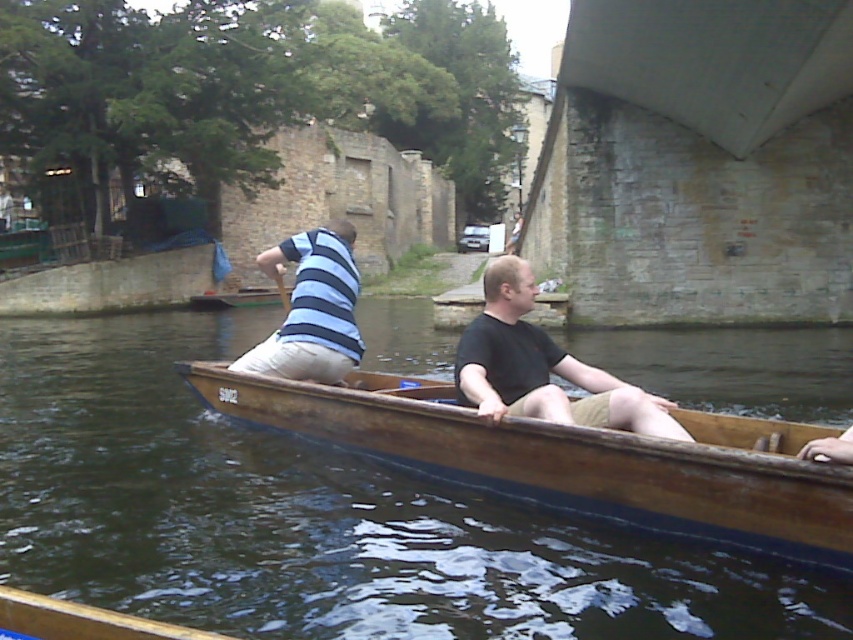
Question: Which of the following is the closest to the observer?

Choices:
 (A) (318, 253)
 (B) (283, 289)
 (C) (547, 353)
 (D) (621, 449)

Answer: (D)

Question: From the image, what is the correct spatial relationship of matte black shirt at center in relation to blue striped shirt at center?

Choices:
 (A) left
 (B) right

Answer: (B)

Question: Does blue striped shirt at center have a lesser width compared to wooden paddle at center?

Choices:
 (A) no
 (B) yes

Answer: (A)

Question: Does wooden canoe at center appear on the right side of wooden paddle at center?

Choices:
 (A) no
 (B) yes

Answer: (B)

Question: Which is farther from the wooden paddle at center?

Choices:
 (A) blue striped shirt at center
 (B) matte black shirt at center
 (C) wooden canoe at center

Answer: (B)

Question: Which is nearer to the matte black shirt at center?

Choices:
 (A) wooden paddle at center
 (B) blue striped shirt at center

Answer: (B)